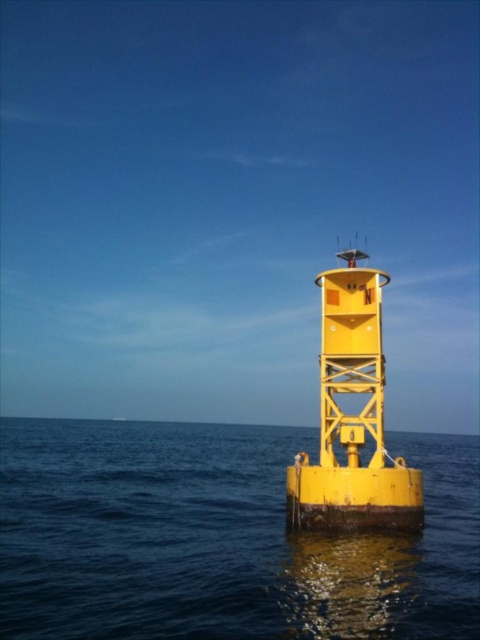
Can you confirm if smooth blue water at center is positioned above metallic yellow buoy at center?

Actually, smooth blue water at center is below metallic yellow buoy at center.

Between smooth blue water at center and metallic yellow buoy at center, which one is positioned lower?

smooth blue water at center

Measure the distance between point (139, 500) and camera.

A distance of 28.90 meters exists between point (139, 500) and camera.

At what (x,y) coordinates should I click in order to perform the action: click on smooth blue water at center. Please return your answer as a coordinate pair (x, y). Looking at the image, I should click on (218, 538).